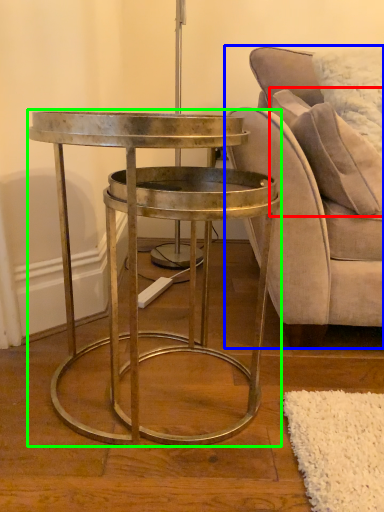
Question: Based on their relative distances, which object is farther from pillow (highlighted by a red box)? Choose from chair (highlighted by a blue box) and table (highlighted by a green box).

Choices:
 (A) chair
 (B) table

Answer: (B)